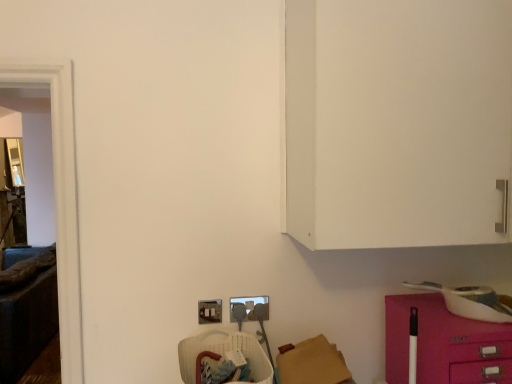
Question: In the image, is translucent plastic basket at lower center positioned in front of or behind pink glossy drawer at lower right?

Choices:
 (A) behind
 (B) front

Answer: (B)

Question: Which is correct: translucent plastic basket at lower center is inside pink glossy drawer at lower right, or outside of it?

Choices:
 (A) outside
 (B) inside

Answer: (A)

Question: Estimate the real-world distances between objects in this image. Which object is farther from the pink glossy drawer at lower right?

Choices:
 (A) matte gray plug at lower center, positioned as the first electric outlet in right-to-left order
 (B) metallic silver electric outlet at lower center, which is the 2th electric outlet from right to left
 (C) translucent plastic basket at lower center
 (D) transparent glass door at left

Answer: (D)

Question: Which object is the farthest from the translucent plastic basket at lower center?

Choices:
 (A) transparent glass door at left
 (B) pink glossy drawer at lower right
 (C) matte gray plug at lower center, positioned as the first electric outlet in right-to-left order
 (D) metallic silver electric outlet at lower center, arranged as the 1th electric outlet when viewed from the left

Answer: (B)